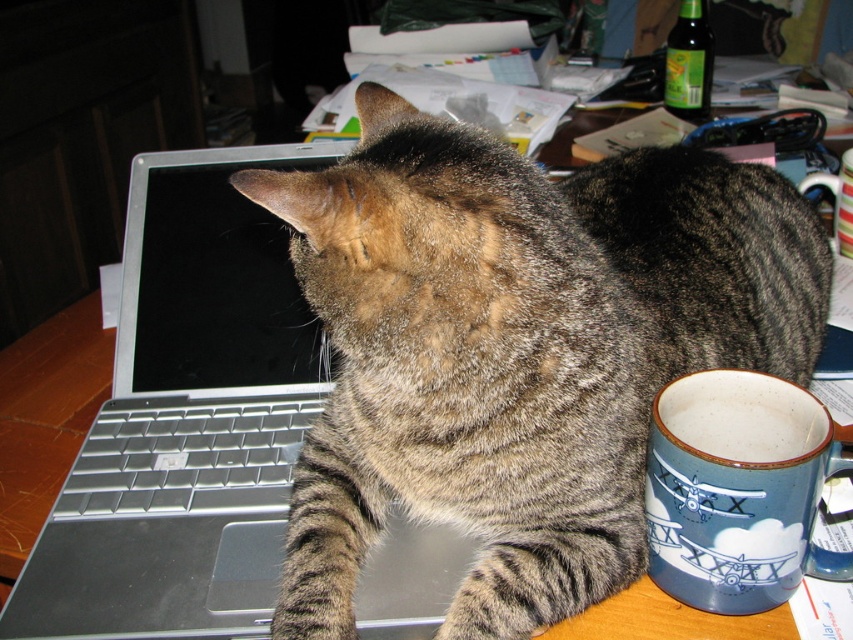
Question: Can you confirm if green glass bottle at upper center is positioned above blue ceramic mug at upper center?

Choices:
 (A) yes
 (B) no

Answer: (A)

Question: Among these points, which one is farthest from the camera?

Choices:
 (A) (799, 180)
 (B) (212, 424)
 (C) (703, 84)
 (D) (599, 589)

Answer: (C)

Question: Is green glass bottle at upper center smaller than blue ceramic mug at upper center?

Choices:
 (A) yes
 (B) no

Answer: (A)

Question: Which of the following is the closest to the observer?

Choices:
 (A) (840, 168)
 (B) (125, 445)
 (C) (805, 458)

Answer: (C)

Question: Which point is farther to the camera?

Choices:
 (A) blue stoneware mug at lower right
 (B) tabby fur cat at center
 (C) silver metallic keyboard at center

Answer: (C)

Question: Can you confirm if tabby fur cat at center is smaller than silver metallic keyboard at center?

Choices:
 (A) no
 (B) yes

Answer: (A)